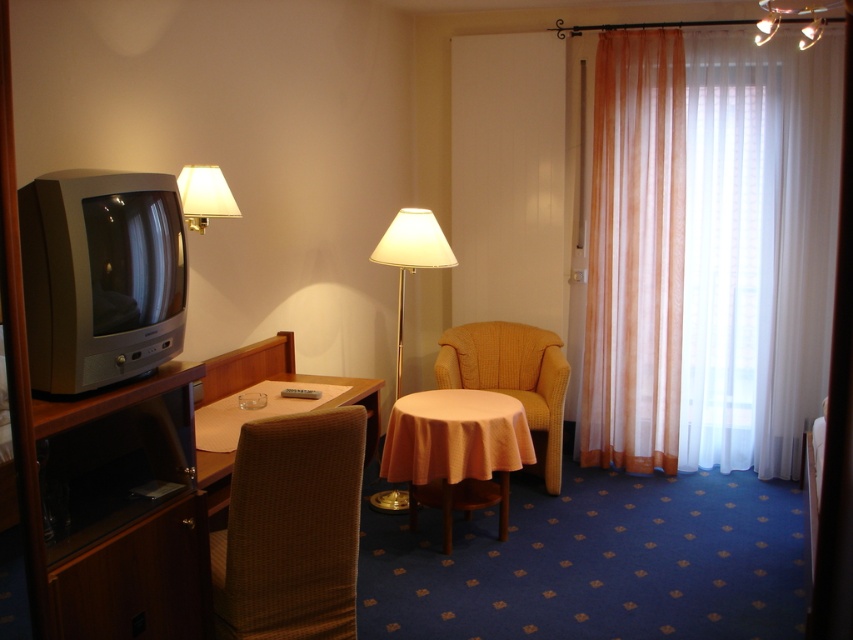
Question: Which of the following is the closest to the observer?

Choices:
 (A) (233, 522)
 (B) (183, 204)

Answer: (A)

Question: Is woven fabric swivel chair at lower left positioned before yellow knitted armchair at center?

Choices:
 (A) no
 (B) yes

Answer: (B)

Question: Is translucent white curtain at right smaller than white fabric lampshade at upper left?

Choices:
 (A) yes
 (B) no

Answer: (B)

Question: Which object appears closest to the camera in this image?

Choices:
 (A) white fabric lampshade at center
 (B) orange fabric table at center

Answer: (B)

Question: Which point is closer to the camera?

Choices:
 (A) (552, 336)
 (B) (444, 524)
 (C) (682, 444)

Answer: (B)

Question: Is woven fabric swivel chair at lower left smaller than matte brown table at center?

Choices:
 (A) no
 (B) yes

Answer: (B)